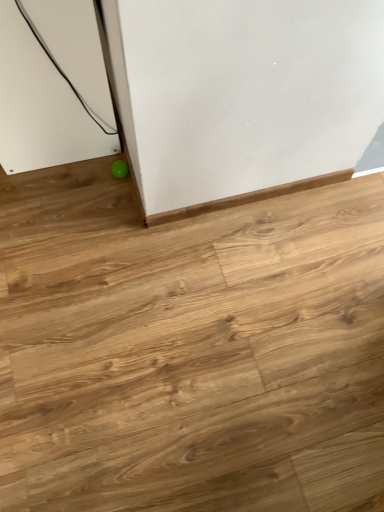
Locate an element on the screen. vacant space to the left of green rubber ball at lower left is located at coordinates (77, 178).